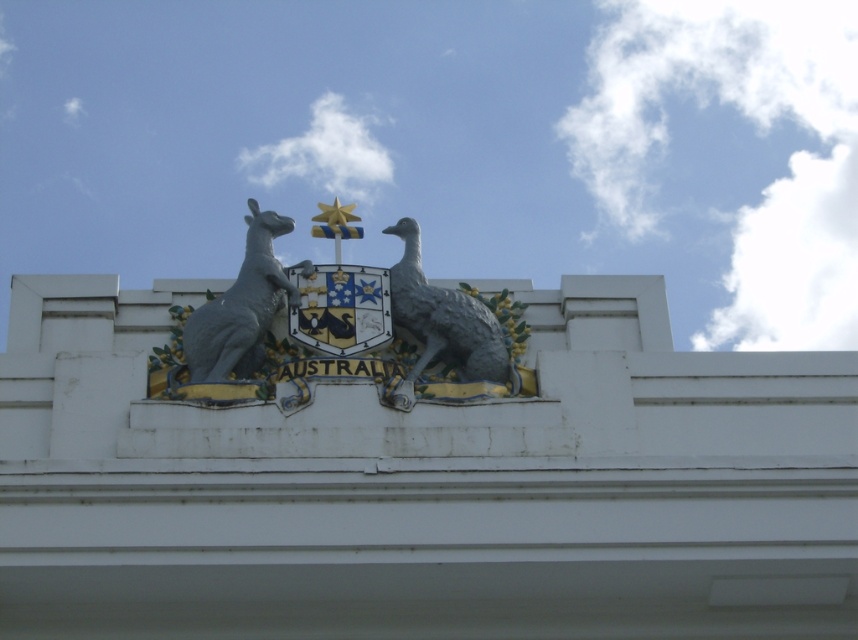
You are an architect designing a scale model of this building facade. The model will be 1 meter wide. If the distance between the gray metallic bird at center and the gray metallic kangaroo at upper left in the original is 6.02 meters, how wide should the model be to maintain the same scale?

The original distance between the gray metallic bird at center and the gray metallic kangaroo at upper left is 6.02 meters. To maintain the same scale in the model, which is 1 meter wide, the model would need to be scaled down proportionally. However, since the question specifies the model width as 1 meter, the distance between the two objects in the model would be 1 meter, maintaining the same relative proportions as the original.